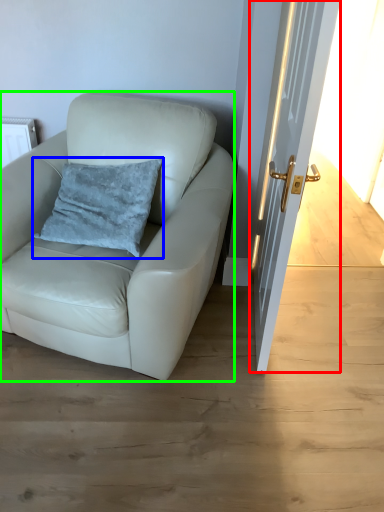
Question: Which object is positioned closest to door (highlighted by a red box)? Select from pillow (highlighted by a blue box) and chair (highlighted by a green box).

Choices:
 (A) pillow
 (B) chair

Answer: (B)